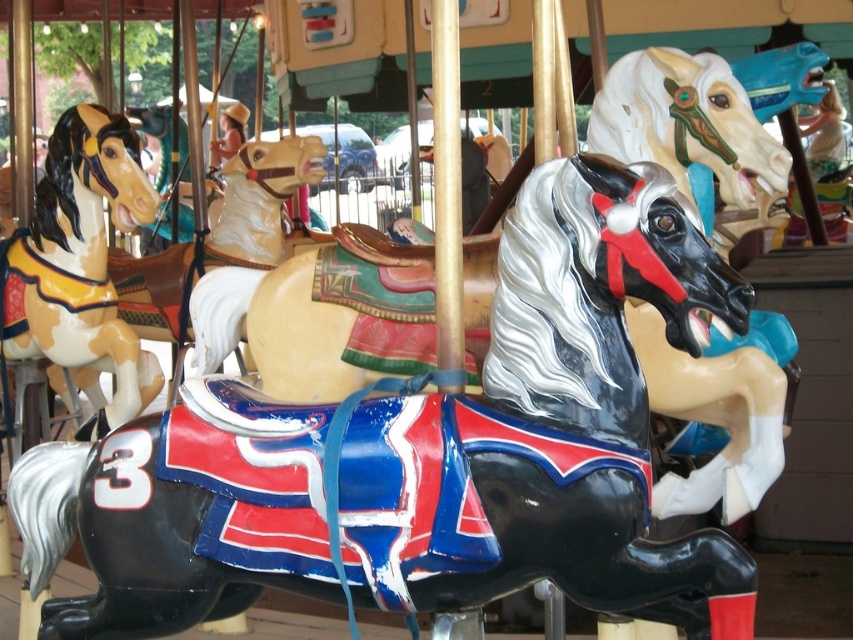
Does shiny black horse at center have a larger size compared to matte brown horse at center?

No, shiny black horse at center is not bigger than matte brown horse at center.

The image size is (853, 640). Identify the location of shiny black horse at center. (550, 424).

Does shiny black horse at center have a greater height compared to matte brown horse at left?

No.

Between point (430, 486) and point (73, 134), which one is positioned in front?

Point (430, 486) is in front.

What do you see at coordinates (550, 424) in the screenshot? This screenshot has width=853, height=640. I see `shiny black horse at center` at bounding box center [550, 424].

Identify the location of shiny black horse at center. (550, 424).

Which is more to the left, matte brown horse at left or matte brown horse at center?

From the viewer's perspective, matte brown horse at left appears more on the left side.

Is point (27, 349) positioned behind point (280, 184)?

No, (27, 349) is closer to viewer.

The image size is (853, 640). What are the coordinates of `matte brown horse at left` in the screenshot? It's located at (80, 260).